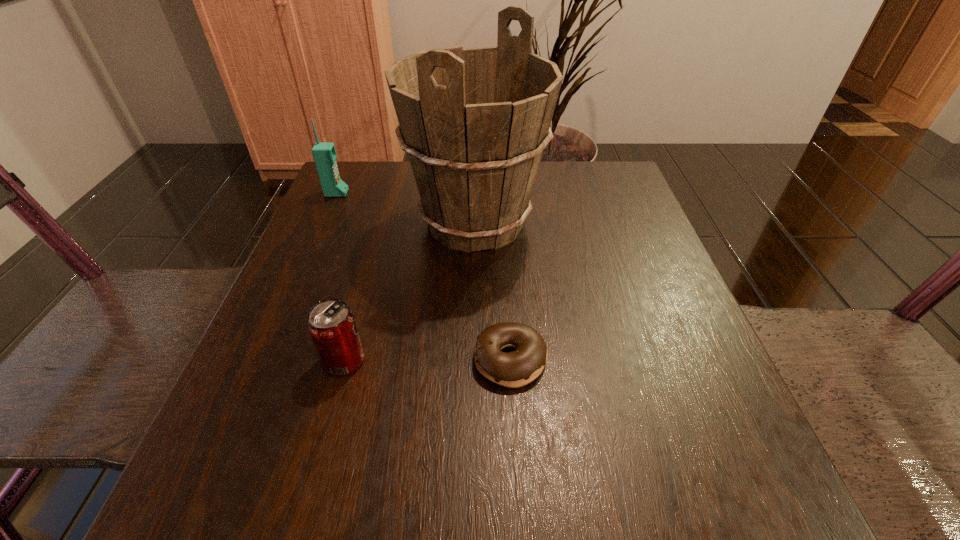
What are the coordinates of `bucket that is at the far edge` in the screenshot? It's located at 474,122.

Image resolution: width=960 pixels, height=540 pixels. In order to click on cellular telephone located in the far edge section of the desktop in this screenshot , I will do `click(324, 153)`.

At what (x,y) coordinates should I click in order to perform the action: click on cellular telephone present at the left edge. Please return your answer as a coordinate pair (x, y). The image size is (960, 540). Looking at the image, I should click on (324, 153).

Find the location of a particular element. The width and height of the screenshot is (960, 540). pop soda located at the left edge is located at coordinates (331, 324).

At what (x,y) coordinates should I click in order to perform the action: click on object that is at the far left corner. Please return your answer as a coordinate pair (x, y). Image resolution: width=960 pixels, height=540 pixels. Looking at the image, I should click on (324, 153).

You are a GUI agent. You are given a task and a screenshot of the screen. Output one action in this format:
    pyautogui.click(x=<x>, y=<y>)
    Task: Click on the free space at the far edge of the desktop
    The image size is (960, 540).
    Given the screenshot: What is the action you would take?
    pyautogui.click(x=538, y=190)

The width and height of the screenshot is (960, 540). What are the coordinates of `vacant area at the left edge of the desktop` in the screenshot? It's located at (313, 281).

Image resolution: width=960 pixels, height=540 pixels. I want to click on vacant space at the right edge of the desktop, so click(x=632, y=237).

This screenshot has width=960, height=540. Find the location of `free space at the far left corner of the desktop`. free space at the far left corner of the desktop is located at coordinates (384, 194).

This screenshot has width=960, height=540. I want to click on free point at the near left corner, so click(231, 506).